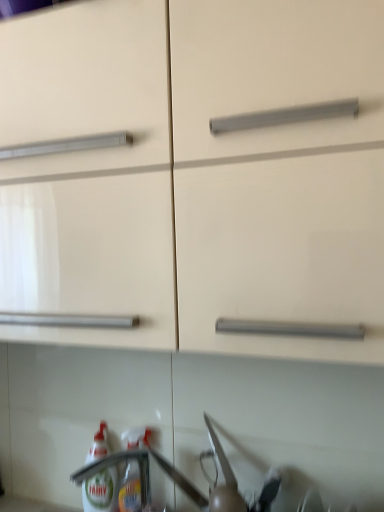
Question: Considering the positions of matte white cabinet at center and translucent plastic bottle at lower left, arranged as the second bottle when viewed from the left, in the image, is matte white cabinet at center wider or thinner than translucent plastic bottle at lower left, arranged as the second bottle when viewed from the left,?

Choices:
 (A) thin
 (B) wide

Answer: (B)

Question: In terms of size, does matte white cabinet at center appear bigger or smaller than translucent plastic bottle at lower left, positioned as the first bottle in right-to-left order?

Choices:
 (A) small
 (B) big

Answer: (B)

Question: Based on their relative distances, which object is farther from the matte white cabinet at center?

Choices:
 (A) white glossy bottle at lower left, acting as the second bottle starting from the right
 (B) translucent plastic bottle at lower left, positioned as the first bottle in right-to-left order

Answer: (A)

Question: Estimate the real-world distances between objects in this image. Which object is farther from the translucent plastic bottle at lower left, positioned as the first bottle in right-to-left order?

Choices:
 (A) matte white cabinet at center
 (B) white glossy bottle at lower left, acting as the second bottle starting from the right

Answer: (A)